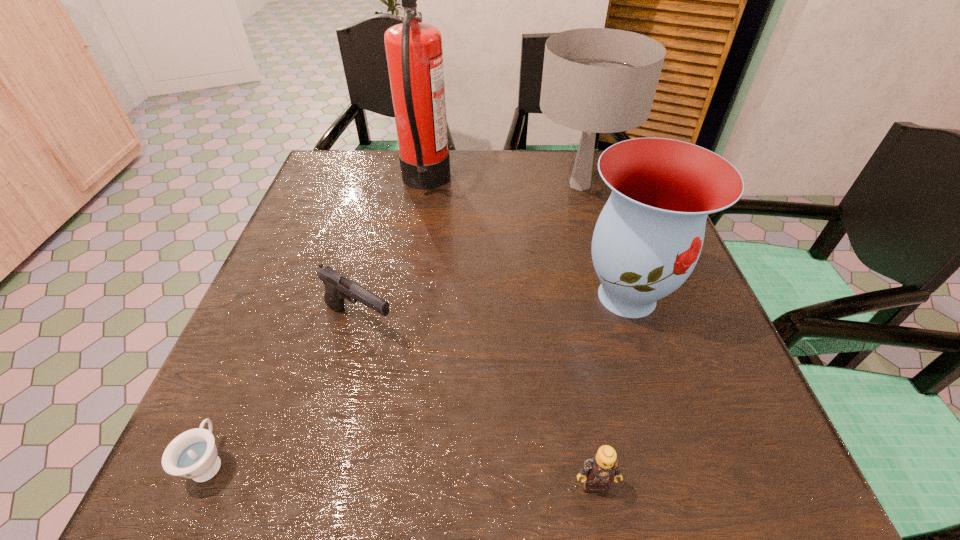
This screenshot has width=960, height=540. In order to click on the fifth closest object to the vase in this screenshot , I will do `click(193, 454)`.

This screenshot has height=540, width=960. I want to click on the second closest object relative to the tallest object, so click(x=337, y=286).

The width and height of the screenshot is (960, 540). Identify the location of vacant region that satisfies the following two spatial constraints: 1. on the front-facing side of the third tallest object; 2. on the left side of the tallest object. (407, 296).

Locate an element on the screen. free space that satisfies the following two spatial constraints: 1. on the side of the vase with the handle; 2. on the left side of the shortest object is located at coordinates (281, 296).

At what (x,y) coordinates should I click in order to perform the action: click on vacant region that satisfies the following two spatial constraints: 1. on the front-facing side of the fourth shortest object; 2. on the left side of the fifth shortest object. Please return your answer as a coordinate pair (x, y). The image size is (960, 540). Looking at the image, I should click on (612, 296).

Locate an element on the screen. vacant region that satisfies the following two spatial constraints: 1. on the front side of the vase; 2. at the muzzle of the gun is located at coordinates (636, 322).

I want to click on vacant region that satisfies the following two spatial constraints: 1. on the front side of the third tallest object; 2. at the muzzle of the gun, so (636, 322).

You are a GUI agent. You are given a task and a screenshot of the screen. Output one action in this format:
    pyautogui.click(x=<x>, y=<y>)
    Task: Click on the vacant space that satisfies the following two spatial constraints: 1. on the front-facing side of the tallest object; 2. on the left side of the vase
    This screenshot has height=540, width=960.
    Given the screenshot: What is the action you would take?
    tap(407, 296)